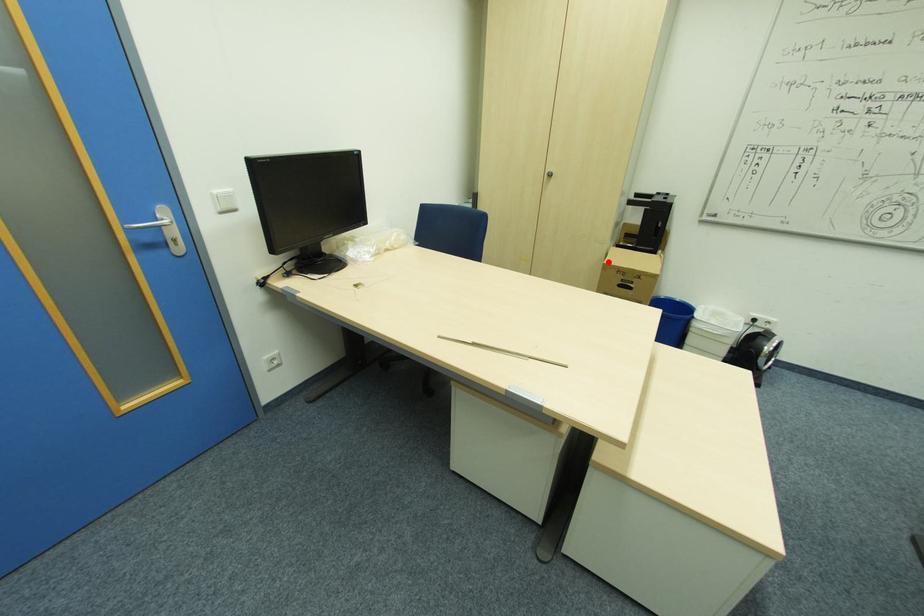
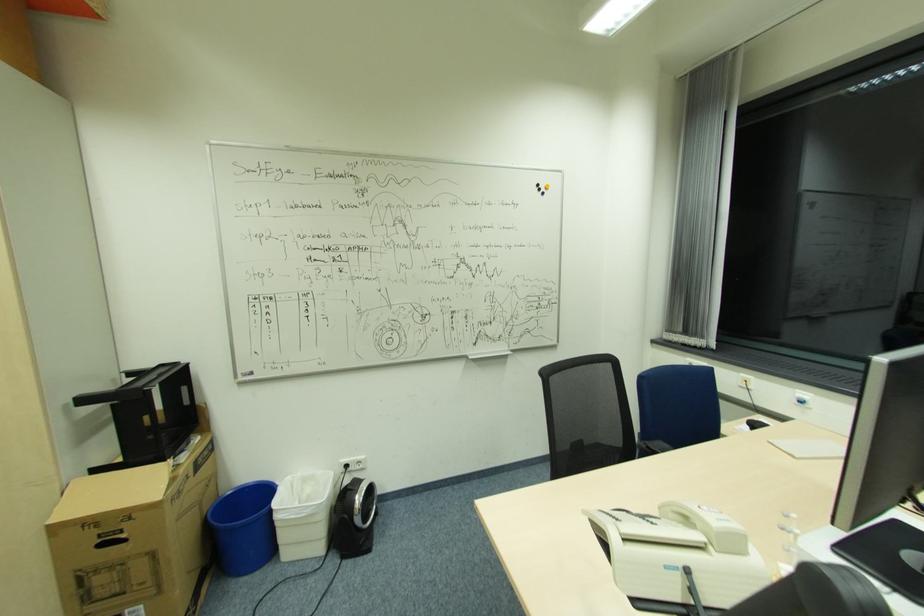
In the second image, find the point that corresponds to the highlighted location in the first image.

(51, 522)